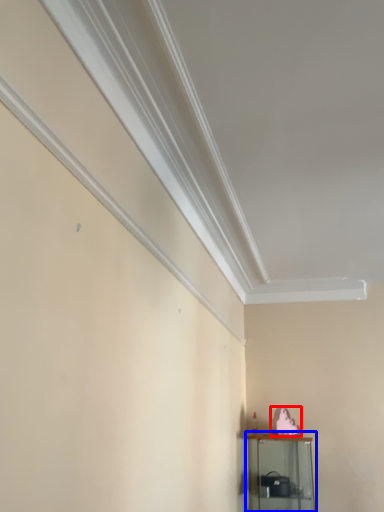
Question: Which object is further to the camera taking this photo, animal (highlighted by a red box) or shelf (highlighted by a blue box)?

Choices:
 (A) animal
 (B) shelf

Answer: (A)